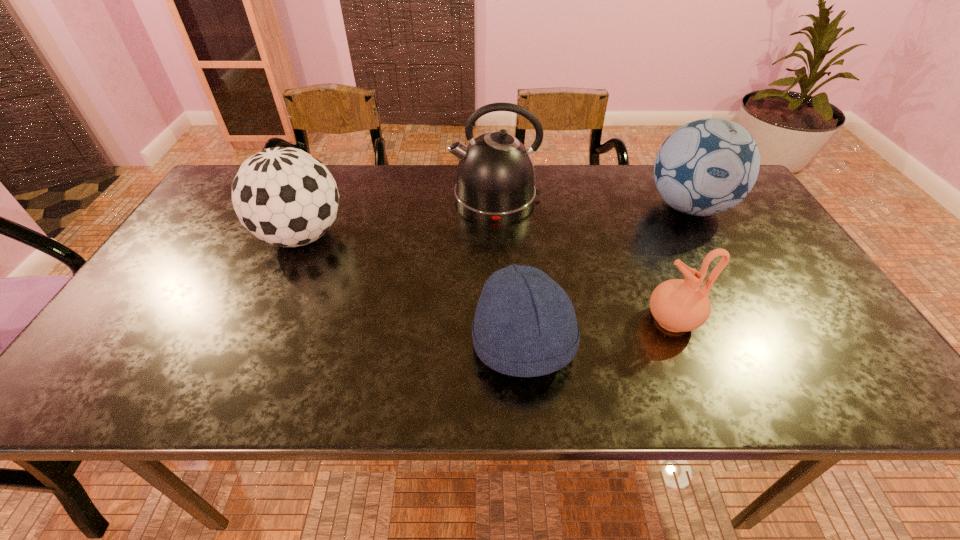
What are the coordinates of `free space that is in between the right soccer ball and the kettle` in the screenshot? It's located at (592, 202).

Identify which object is located as the third nearest to the right soccer ball. Please provide its 2D coordinates. Your answer should be formatted as a tuple, i.e. [(x, y)], where the tuple contains the x and y coordinates of a point satisfying the conditions above.

[(525, 325)]

Identify the location of object identified as the third closest to the kettle. pyautogui.click(x=525, y=325).

Locate an element on the screen. The image size is (960, 540). vacant region that satisfies the following two spatial constraints: 1. on the spout of the kettle; 2. on the right side of the shortest object is located at coordinates (502, 344).

You are a GUI agent. You are given a task and a screenshot of the screen. Output one action in this format:
    pyautogui.click(x=<x>, y=<y>)
    Task: Click on the free spot that satisfies the following two spatial constraints: 1. on the spout of the kettle; 2. on the back side of the skullcap
    
    Given the screenshot: What is the action you would take?
    pyautogui.click(x=502, y=344)